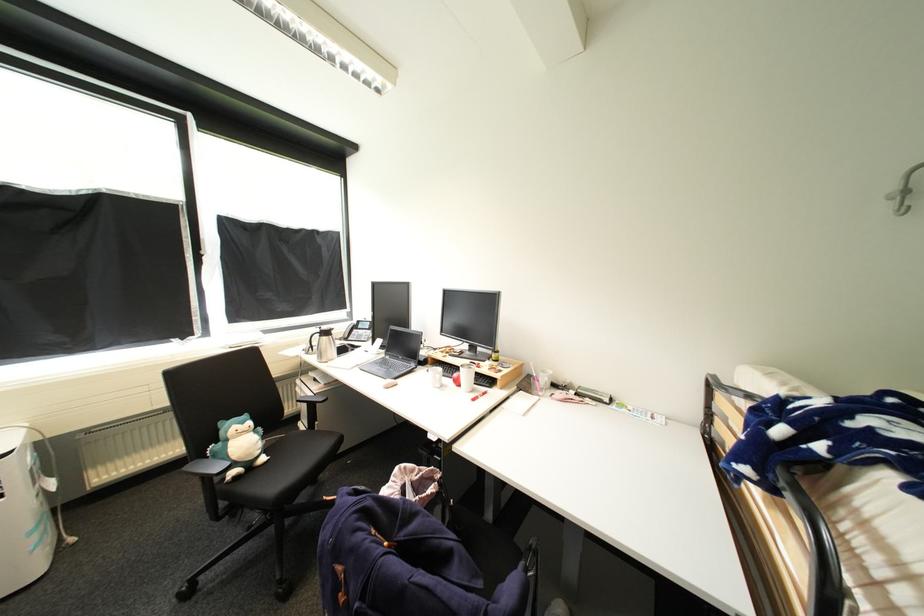
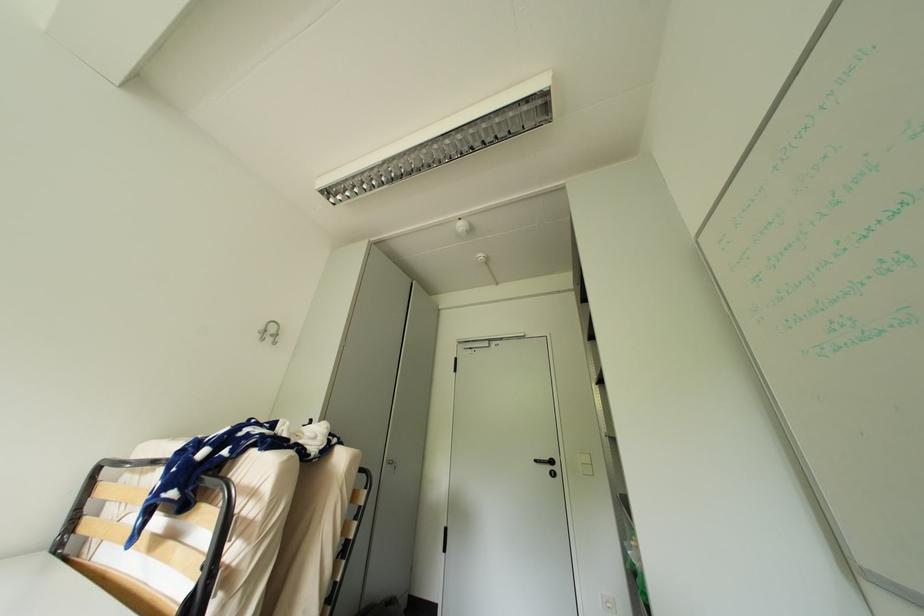
The first image is from the beginning of the video and the second image is from the end. How did the camera likely rotate when shooting the video?

The camera's rotation is toward right-up.